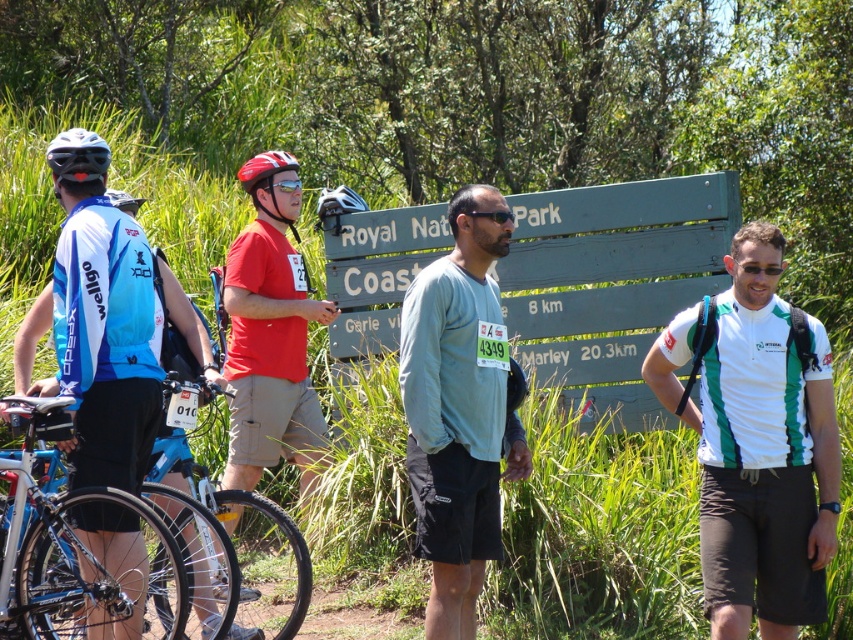
Question: Which object is farther from the camera taking this photo?

Choices:
 (A) white/green striped shirt at center
 (B) black matte sunglasses at center
 (C) green wooden sign at center
 (D) shiny red helmet at center

Answer: (C)

Question: Does black matte bicycle helmet at left lie behind clear plastic goggles at center?

Choices:
 (A) no
 (B) yes

Answer: (A)

Question: Which point appears closest to the camera in this image?

Choices:
 (A) (97, 134)
 (B) (775, 628)
 (C) (93, 371)

Answer: (C)

Question: Which is farther from the white/green striped shirt at center?

Choices:
 (A) light blue long-sleeve shirt at center
 (B) shiny blue bicycle at lower left
 (C) black matte sunglasses at center
 (D) green wooden sign at center

Answer: (B)

Question: From the image, what is the correct spatial relationship of clear plastic goggles at center in relation to black matte sunglasses at center?

Choices:
 (A) right
 (B) left

Answer: (B)

Question: Does blue jersey at left have a larger size compared to clear plastic goggles at center?

Choices:
 (A) yes
 (B) no

Answer: (A)